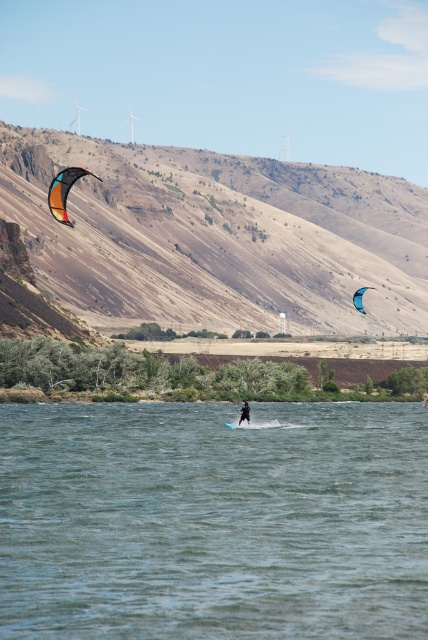
You are standing at the point labeled point[59,184] and want to walk to the point labeled point[356,296]. Which direction should you face to walk towards your destination?

You should face towards the upper right direction because point[356,296] is located in the upper right relative to point[59,184].

You are standing at the camera position and want to retrieve the multicolored fabric kite at left. Can you walk directly to it without any obstacles?

The multicolored fabric kite at left is 153.37 meters away from the camera, so you can walk directly to it as there are no obstacles mentioned in the scene description.